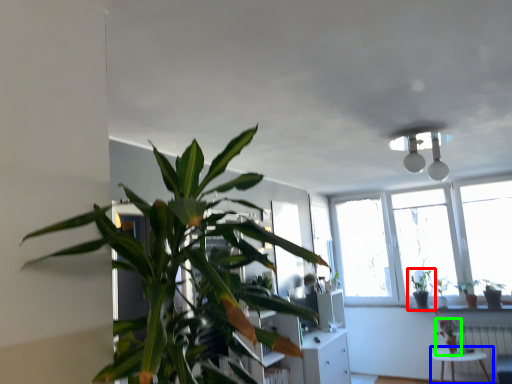
Question: Which object is positioned farthest from houseplant (highlighted by a red box)? Select from table (highlighted by a blue box) and houseplant (highlighted by a green box).

Choices:
 (A) table
 (B) houseplant

Answer: (A)